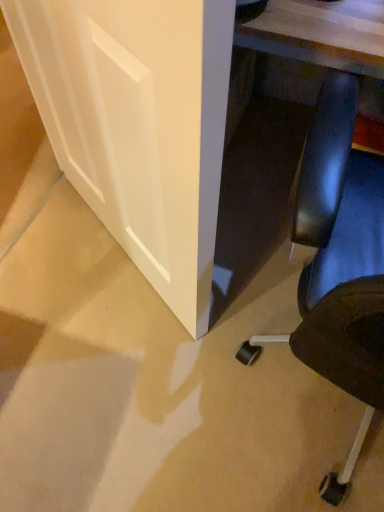
The image size is (384, 512). What do you see at coordinates (339, 263) in the screenshot?
I see `black leather chair at lower right` at bounding box center [339, 263].

This screenshot has height=512, width=384. In order to click on black leather chair at lower right in this screenshot , I will do `click(339, 263)`.

Measure the distance between white matte door at lower left and camera.

white matte door at lower left and camera are 16.13 inches apart from each other.

The height and width of the screenshot is (512, 384). Describe the element at coordinates (138, 124) in the screenshot. I see `white matte door at lower left` at that location.

The image size is (384, 512). In order to click on white matte door at lower left in this screenshot , I will do `click(138, 124)`.

This screenshot has width=384, height=512. In order to click on black leather chair at lower right in this screenshot , I will do `click(339, 263)`.

Which is more to the left, white matte door at lower left or black leather chair at lower right?

white matte door at lower left is more to the left.

Which object is closer to the camera, white matte door at lower left or black leather chair at lower right?

black leather chair at lower right is in front.

Is point (215, 5) closer to viewer compared to point (377, 222)?

Yes, point (215, 5) is in front of point (377, 222).

From the image's perspective, which one is positioned lower, white matte door at lower left or black leather chair at lower right?

black leather chair at lower right, from the image's perspective.

From a real-world perspective, is white matte door at lower left physically located above or below black leather chair at lower right?

white matte door at lower left is situated lower than black leather chair at lower right in the real world.

Does white matte door at lower left have a lesser width compared to black leather chair at lower right?

Indeed, white matte door at lower left has a lesser width compared to black leather chair at lower right.

Which of these two, white matte door at lower left or black leather chair at lower right, stands shorter?

white matte door at lower left is shorter.

Considering the relative sizes of white matte door at lower left and black leather chair at lower right in the image provided, is white matte door at lower left smaller than black leather chair at lower right?

Yes.

Could black leather chair at lower right be considered to be inside white matte door at lower left?

No, black leather chair at lower right is not inside white matte door at lower left.

Would you consider white matte door at lower left to be distant from black leather chair at lower right?

Actually, white matte door at lower left and black leather chair at lower right are a little close together.

Is white matte door at lower left turned away from black leather chair at lower right?

No, white matte door at lower left is not facing the opposite direction of black leather chair at lower right.

How many degrees apart are the facing directions of white matte door at lower left and black leather chair at lower right?

The angle between the facing direction of white matte door at lower left and the facing direction of black leather chair at lower right is 147 degrees.

Find the location of `chair below the white matte door at lower left (from the image's perspective)`. chair below the white matte door at lower left (from the image's perspective) is located at coordinates (339, 263).

Based on the photo, considering the relative positions of black leather chair at lower right and white matte door at lower left in the image provided, is black leather chair at lower right to the left of white matte door at lower left from the viewer's perspective?

No.

Considering their positions, is black leather chair at lower right located in front of or behind white matte door at lower left?

In the image, black leather chair at lower right appears in front of white matte door at lower left.

Which is further, (359, 327) or (152, 0)?

Point (359, 327)

In the scene shown: From the image's perspective, which one is positioned lower, black leather chair at lower right or white matte door at lower left?

black leather chair at lower right.

From a real-world perspective, is black leather chair at lower right positioned above or below white matte door at lower left?

black leather chair at lower right is above white matte door at lower left.

Considering the relative sizes of black leather chair at lower right and white matte door at lower left in the image provided, is black leather chair at lower right thinner than white matte door at lower left?

No, black leather chair at lower right is not thinner than white matte door at lower left.

Between black leather chair at lower right and white matte door at lower left, which one has more height?

With more height is black leather chair at lower right.

Considering the sizes of objects black leather chair at lower right and white matte door at lower left in the image provided, who is smaller, black leather chair at lower right or white matte door at lower left?

Smaller between the two is white matte door at lower left.

Would you say black leather chair at lower right is outside white matte door at lower left?

Indeed, black leather chair at lower right is completely outside white matte door at lower left.

Looking at this image, is black leather chair at lower right directly adjacent to white matte door at lower left?

They are not placed beside each other.

Is black leather chair at lower right positioned with its back to white matte door at lower left?

That's not correct — black leather chair at lower right is not looking away from white matte door at lower left.

Can you tell me how much black leather chair at lower right and white matte door at lower left differ in facing direction?

They differ by 147 degrees in their facing directions.

I want to click on glass door above the black leather chair at lower right (from the image's perspective), so click(x=138, y=124).

Identify the location of chair that appears in front of the white matte door at lower left. (339, 263).

Identify the location of glass door behind the black leather chair at lower right. Image resolution: width=384 pixels, height=512 pixels. (138, 124).